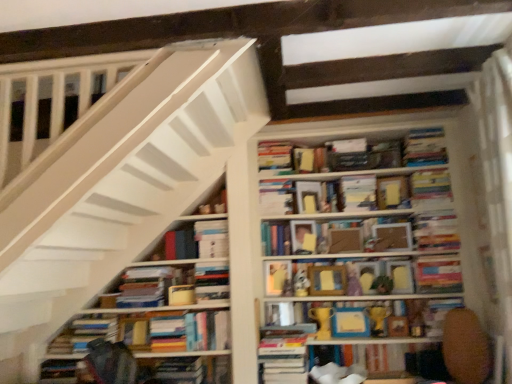
Question: Which direction should I rotate to look at matte cardboard book at center, the 7th paperback book when ordered from right to left, — up or down?

Choices:
 (A) down
 (B) up

Answer: (A)

Question: Which direction should I rotate to face hardcover books at center, which ranks as the 9th book in right-to-left order, — up or down?

Choices:
 (A) down
 (B) up

Answer: (B)

Question: Does hardcover books at center, which ranks as the 9th book in right-to-left order, have a greater width compared to hardcover book at upper right, acting as the first paperback book starting from the right?

Choices:
 (A) yes
 (B) no

Answer: (B)

Question: Is hardcover books at center, the 5th book when ordered from left to right, oriented towards hardcover book at upper right, the thirteenth paperback book from the left?

Choices:
 (A) no
 (B) yes

Answer: (A)

Question: Are hardcover books at center, the 5th book when ordered from left to right, and hardcover book at upper right, the thirteenth paperback book from the left, far apart?

Choices:
 (A) yes
 (B) no

Answer: (B)

Question: Considering the relative positions of hardcover books at center, which ranks as the 9th book in right-to-left order, and hardcover book at upper right, acting as the first paperback book starting from the right, in the image provided, is hardcover books at center, which ranks as the 9th book in right-to-left order, behind hardcover book at upper right, acting as the first paperback book starting from the right,?

Choices:
 (A) no
 (B) yes

Answer: (B)

Question: Is hardcover books at center, the 5th book when ordered from left to right, at the right side of hardcover book at upper right, acting as the first paperback book starting from the right?

Choices:
 (A) no
 (B) yes

Answer: (A)

Question: Considering the relative sizes of hardcover books at center, which ranks as the 9th book in right-to-left order, and hardcover book at upper right, acting as the first paperback book starting from the right, in the image provided, is hardcover books at center, which ranks as the 9th book in right-to-left order, bigger than hardcover book at upper right, acting as the first paperback book starting from the right,?

Choices:
 (A) no
 (B) yes

Answer: (A)

Question: Are matte yellow paperback book at center, which is the 6th paperback book from right to left, and hardcover book at lower right, which ranks as the fourth book in right-to-left order, beside each other?

Choices:
 (A) yes
 (B) no

Answer: (B)

Question: Considering the relative sizes of matte yellow paperback book at center, which is the 6th paperback book from right to left, and hardcover book at lower right, arranged as the 10th book when viewed from the left, in the image provided, is matte yellow paperback book at center, which is the 6th paperback book from right to left, wider than hardcover book at lower right, arranged as the 10th book when viewed from the left,?

Choices:
 (A) yes
 (B) no

Answer: (B)

Question: Is matte yellow paperback book at center, which is the 6th paperback book from right to left, surrounding hardcover book at lower right, which ranks as the fourth book in right-to-left order?

Choices:
 (A) no
 (B) yes

Answer: (A)

Question: Does matte yellow paperback book at center, the 8th paperback book positioned from the left, have a larger size compared to hardcover book at lower right, which ranks as the fourth book in right-to-left order?

Choices:
 (A) no
 (B) yes

Answer: (A)

Question: Is matte yellow paperback book at center, the 8th paperback book positioned from the left, thinner than hardcover book at lower right, arranged as the 10th book when viewed from the left?

Choices:
 (A) no
 (B) yes

Answer: (B)

Question: Considering the relative sizes of matte yellow paperback book at center, the 8th paperback book positioned from the left, and hardcover book at lower right, which ranks as the fourth book in right-to-left order, in the image provided, is matte yellow paperback book at center, the 8th paperback book positioned from the left, shorter than hardcover book at lower right, which ranks as the fourth book in right-to-left order,?

Choices:
 (A) no
 (B) yes

Answer: (A)

Question: Are hardcover book at center, the 12th paperback book in the left-to-right sequence, and hardcover book at center, the eleventh book from the right, located far from each other?

Choices:
 (A) no
 (B) yes

Answer: (B)